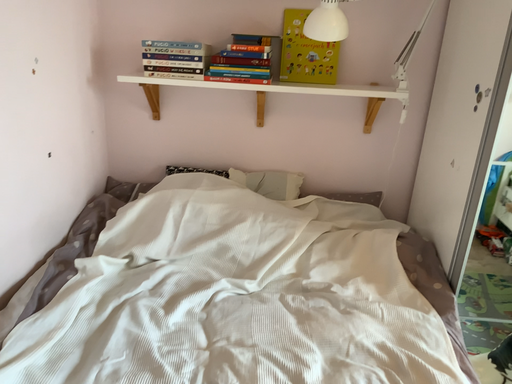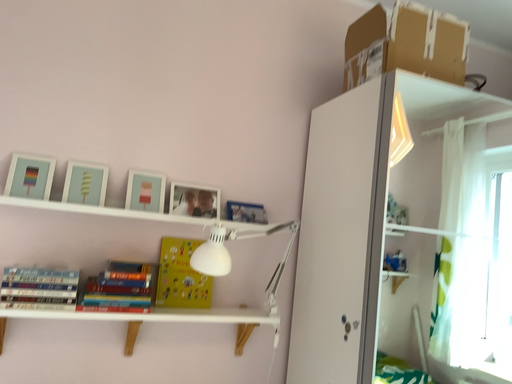
Question: How did the camera likely rotate when shooting the video?

Choices:
 (A) rotated upward
 (B) rotated downward

Answer: (A)